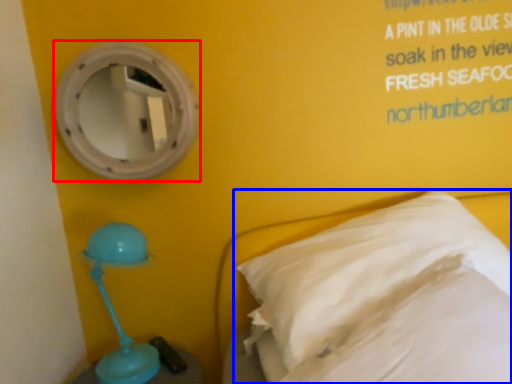
Question: Which of the following is the closest to the observer, mirror (highlighted by a red box) or pillow (highlighted by a blue box)?

Choices:
 (A) mirror
 (B) pillow

Answer: (B)